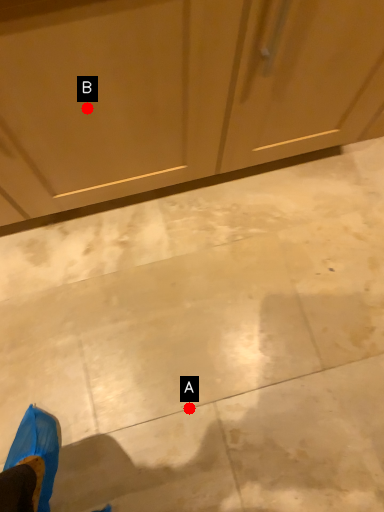
Question: Two points are circled on the image, labeled by A and B beside each circle. Which of the following is the farthest from the observer?

Choices:
 (A) A is further
 (B) B is further

Answer: (A)